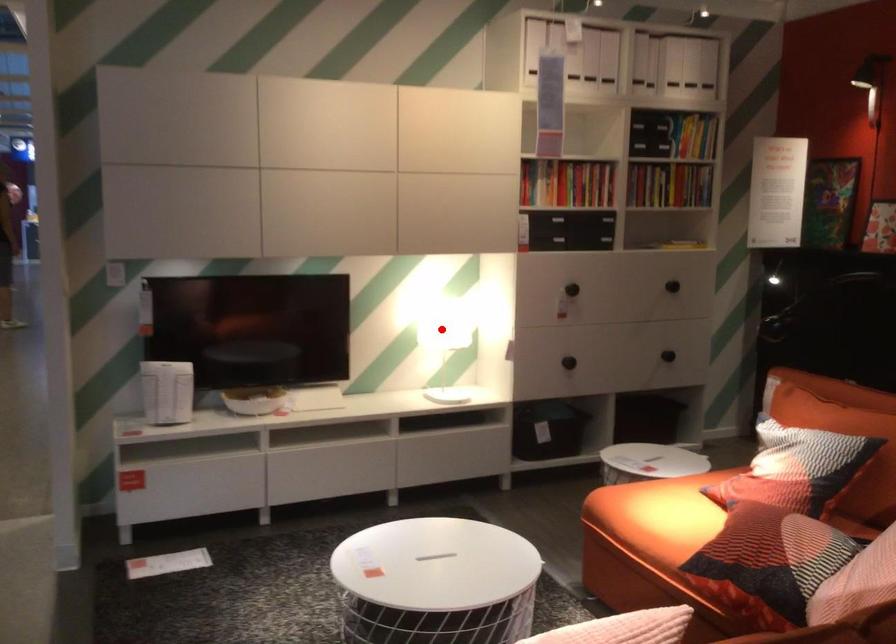
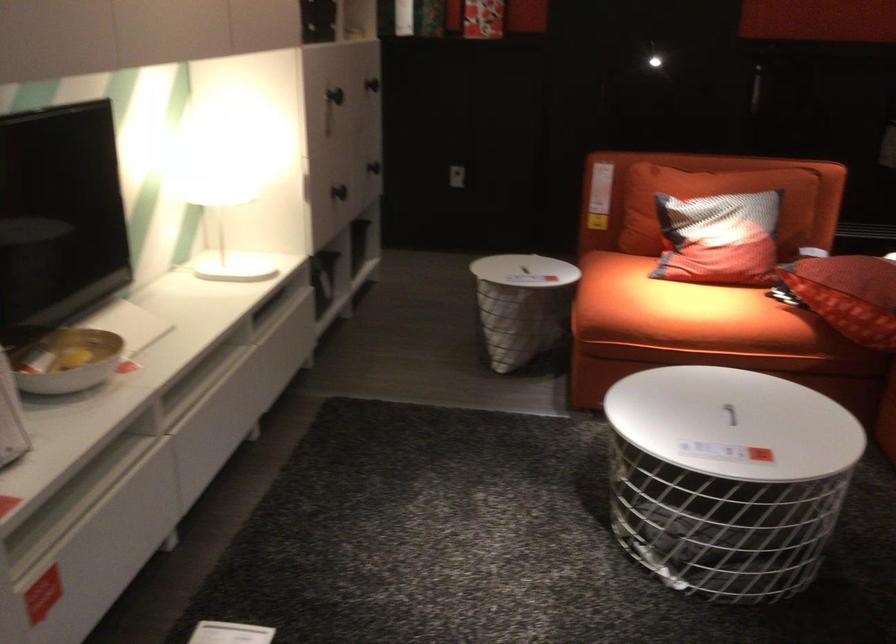
Question: I am providing you with two images of the same scene from different viewpoints. In image1, a red point is highlighted. Considering the same 3D point in image2, which of the following is correct?

Choices:
 (A) It is closer
 (B) It is farther

Answer: (A)